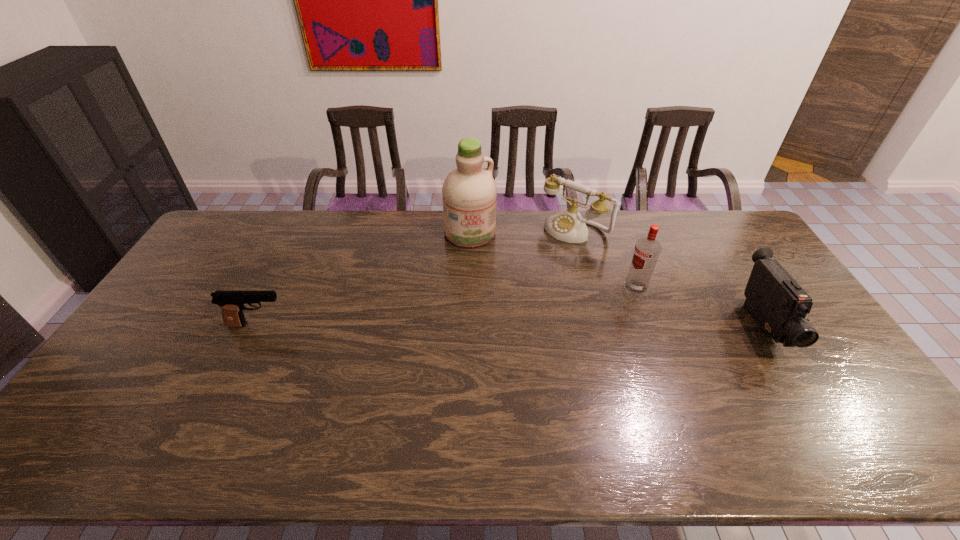
You are a GUI agent. You are given a task and a screenshot of the screen. Output one action in this format:
    pyautogui.click(x=<x>, y=<y>)
    Task: Click on the free space located 0.320m on the front label of the cleansing agent
    This screenshot has width=960, height=540.
    Given the screenshot: What is the action you would take?
    pyautogui.click(x=500, y=313)

At what (x,y) coordinates should I click in order to perform the action: click on vacant space positioned on the front label of the cleansing agent. Please return your answer as a coordinate pair (x, y). The image size is (960, 540). Looking at the image, I should click on (493, 295).

This screenshot has height=540, width=960. I want to click on free space located 0.240m on the dial of the telephone, so click(x=521, y=277).

Locate an element on the screen. This screenshot has width=960, height=540. vacant area located on the dial of the telephone is located at coordinates (540, 258).

Identify the location of vacant point located 0.400m on the dial of the telephone. (492, 305).

Locate an element on the screen. vacant position located on the front label of the second tallest object is located at coordinates (602, 308).

Where is `free region located 0.100m on the front label of the second tallest object`? free region located 0.100m on the front label of the second tallest object is located at coordinates (606, 305).

You are a GUI agent. You are given a task and a screenshot of the screen. Output one action in this format:
    pyautogui.click(x=<x>, y=<y>)
    Task: Click on the free location located 0.130m on the front label of the second tallest object
    This screenshot has height=540, width=960.
    Given the screenshot: What is the action you would take?
    pyautogui.click(x=599, y=309)

Identify the location of cleansing agent at the far edge. The image size is (960, 540). 469,192.

Identify the location of telephone that is at the far edge. This screenshot has width=960, height=540. (568, 225).